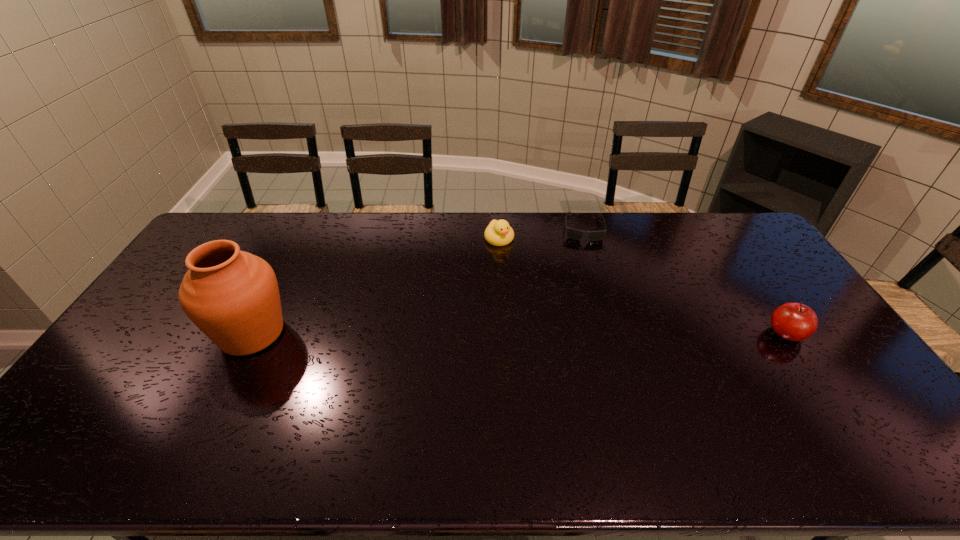
This screenshot has width=960, height=540. What are the coordinates of `vacant spot on the desktop that is between the urn and the rightmost object and is positioned on the face of the duckling` in the screenshot? It's located at (566, 333).

The height and width of the screenshot is (540, 960). I want to click on free space on the desktop that is between the urn and the rightmost object and is positioned on the front-facing side of the shortest object, so click(x=589, y=333).